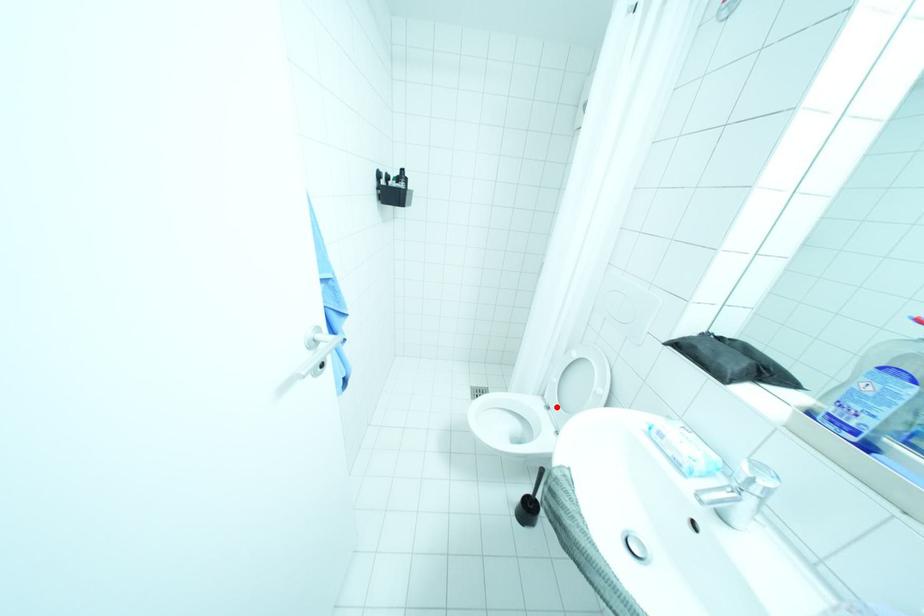
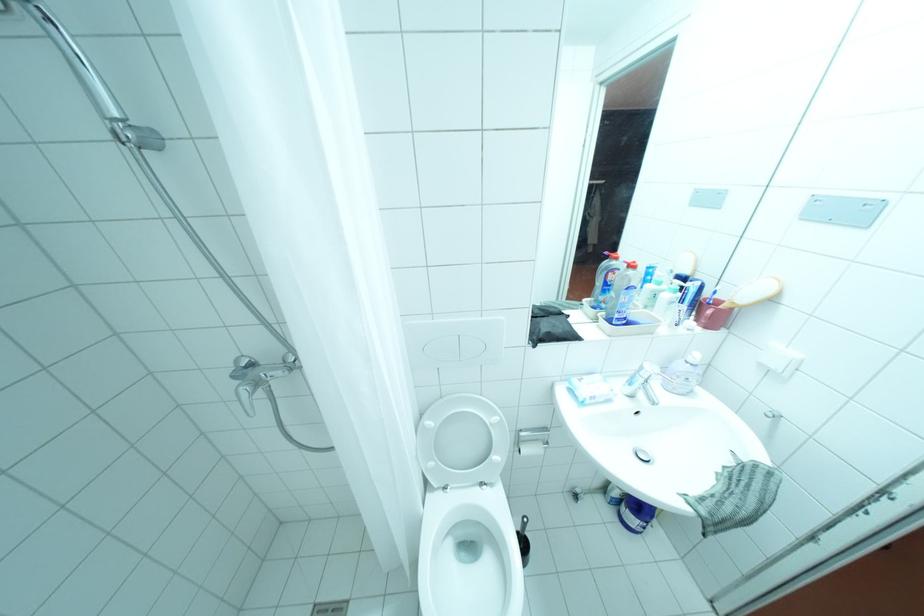
The point at the highlighted location is marked in the first image. Where is the corresponding point in the second image?

(455, 487)